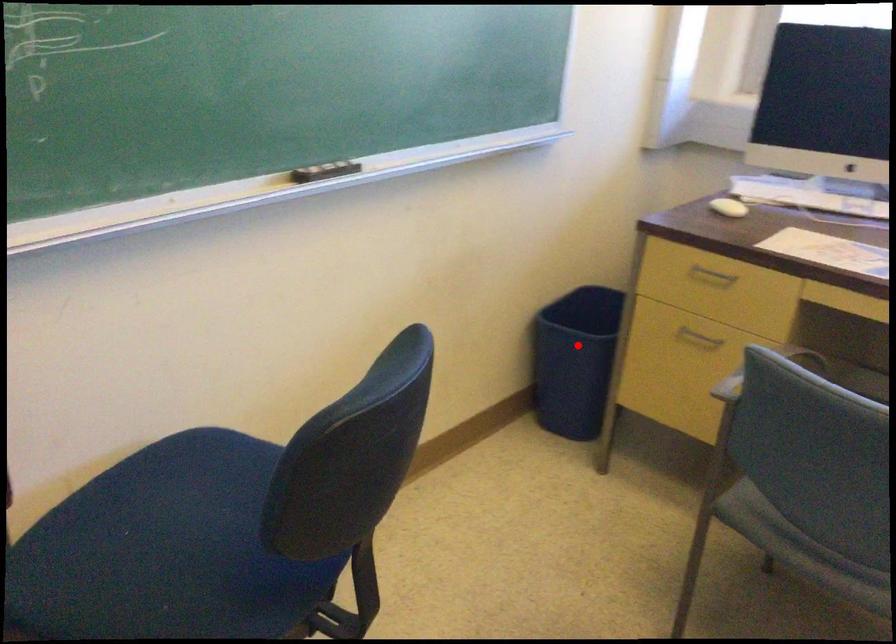
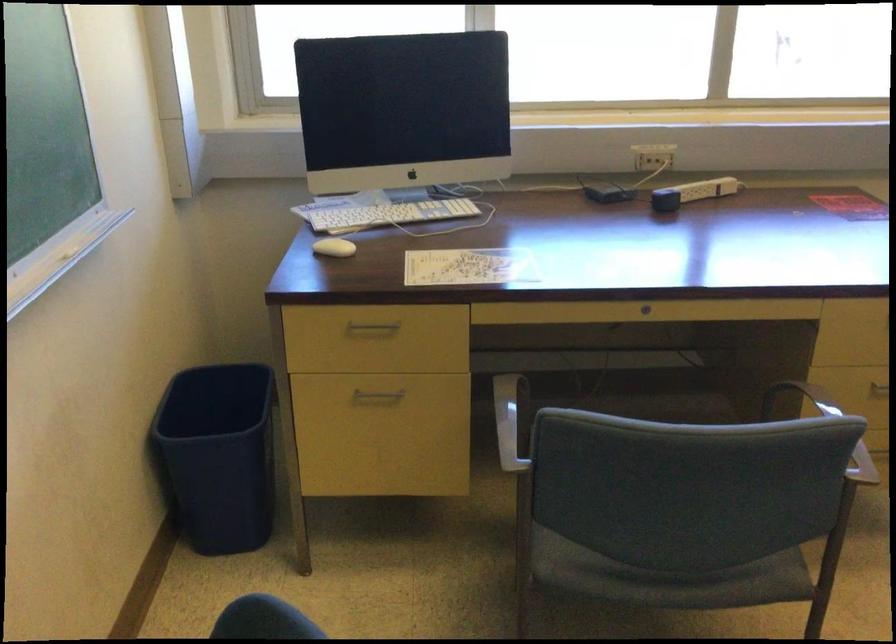
The point at the highlighted location is marked in the first image. Where is the corresponding point in the second image?

(217, 456)